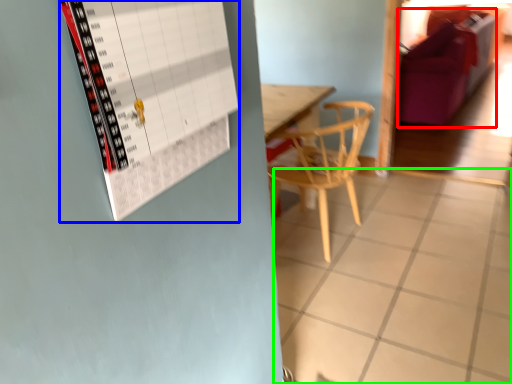
Question: Which object is positioned closest to couch (highlighted by a red box)? Select from bulletin board (highlighted by a blue box) and tile (highlighted by a green box).

Choices:
 (A) bulletin board
 (B) tile

Answer: (B)